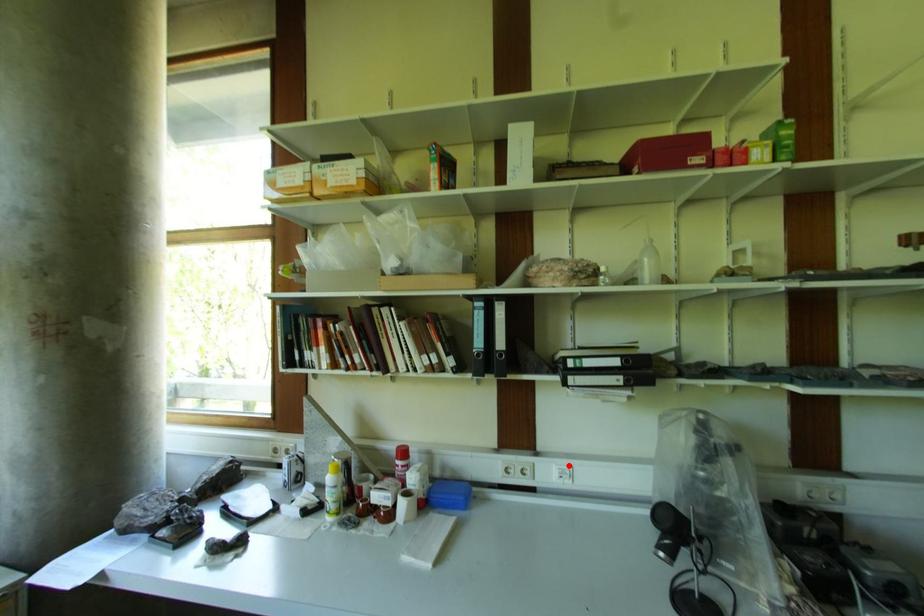
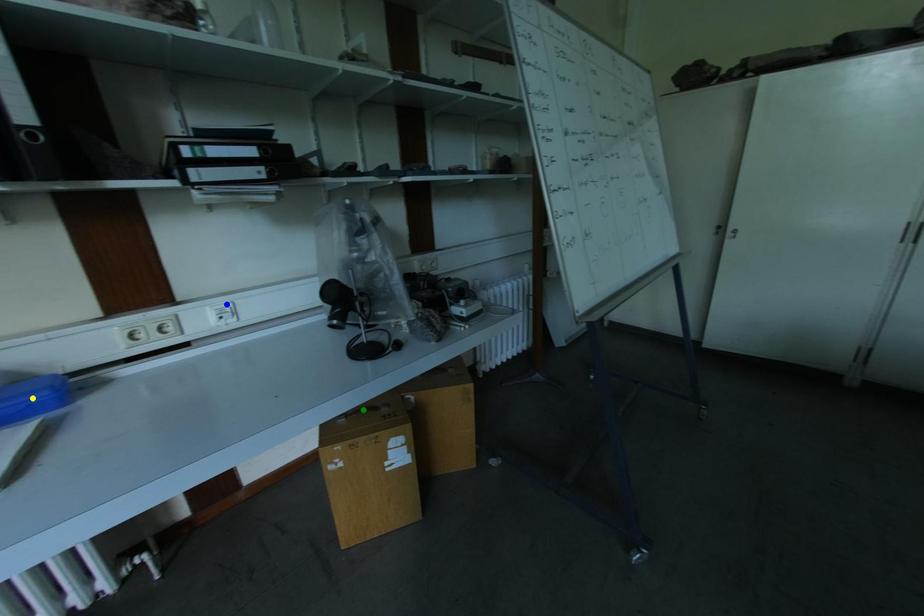
Question: I am providing you with two images of the same scene from different viewpoints. A red point is marked on the first image. You are given multiple points on the second image. Which mark in image 2 goes with the point in image 1?

Choices:
 (A) yellow point
 (B) green point
 (C) blue point

Answer: (C)